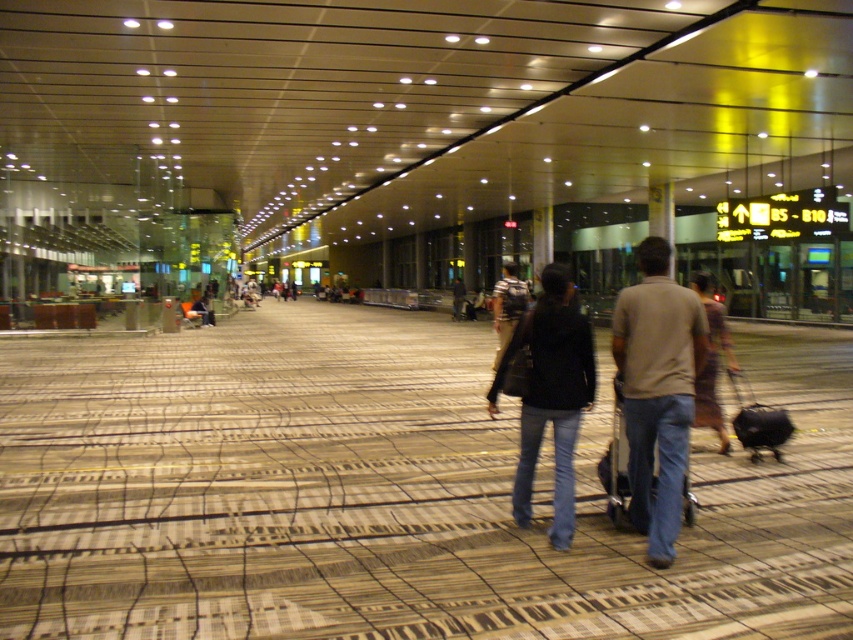
Is beige cotton shirt at center further to camera compared to striped cotton shirt at center?

No, it is not.

Is beige cotton shirt at center smaller than striped cotton shirt at center?

Indeed, beige cotton shirt at center has a smaller size compared to striped cotton shirt at center.

Describe the element at coordinates (657, 392) in the screenshot. The height and width of the screenshot is (640, 853). I see `beige cotton shirt at center` at that location.

Where is `beige cotton shirt at center`? This screenshot has height=640, width=853. beige cotton shirt at center is located at coordinates (657, 392).

Does dark brown leather jacket at center have a greater height compared to striped cotton shirt at center?

Indeed, dark brown leather jacket at center has a greater height compared to striped cotton shirt at center.

Is dark brown leather jacket at center wider than striped cotton shirt at center?

Indeed, dark brown leather jacket at center has a greater width compared to striped cotton shirt at center.

Between point (675, 364) and point (502, 353), which one is positioned behind?

Point (502, 353)

The height and width of the screenshot is (640, 853). Find the location of `dark brown leather jacket at center`. dark brown leather jacket at center is located at coordinates (657, 390).

Does dark brown dress at center have a greater width compared to black matte suitcase at center?

Indeed, dark brown dress at center has a greater width compared to black matte suitcase at center.

Is dark brown dress at center shorter than black matte suitcase at center?

In fact, dark brown dress at center may be taller than black matte suitcase at center.

The image size is (853, 640). Describe the element at coordinates (711, 362) in the screenshot. I see `dark brown dress at center` at that location.

Image resolution: width=853 pixels, height=640 pixels. What are the coordinates of `dark brown dress at center` in the screenshot? It's located at (711, 362).